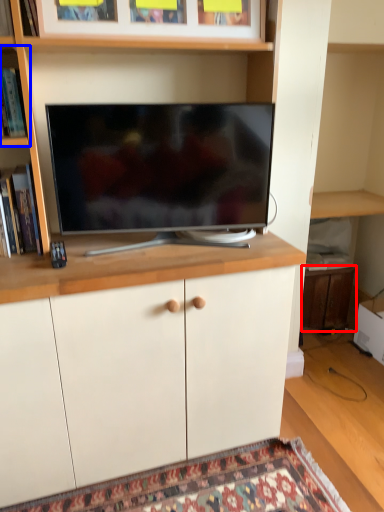
Question: Which of the following is the closest to the observer, cabinetry (highlighted by a red box) or shelf (highlighted by a blue box)?

Choices:
 (A) cabinetry
 (B) shelf

Answer: (B)